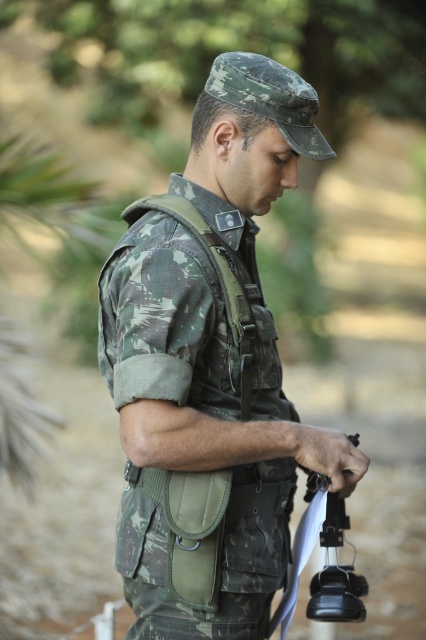
You are a photographer who needs to capture a closeup shot of the black plastic gun at center. The camouflage fabric uniform at center is blocking part of the gun. Can you adjust your position to focus on the gun without moving the subject?

The camouflage fabric uniform at center is wider than the black plastic gun at center, so adjusting your position slightly to the side might allow you to frame the gun while avoiding the uniform obstruction.

You are a photographer positioned at a certain distance from the camouflage fabric uniform at center. Your camera has a focal length of 50mm and an aperture of f2.8. To ensure the uniform remains in focus while the background is blurred, what adjustment can you make to your camera settings?

The camouflage fabric uniform at center is 6.45 feet away from the viewer. To keep it in focus while blurring the background, you can increase the aperture value to a smaller opening, like f1.4, which allows more light and creates a shallower depth of field.